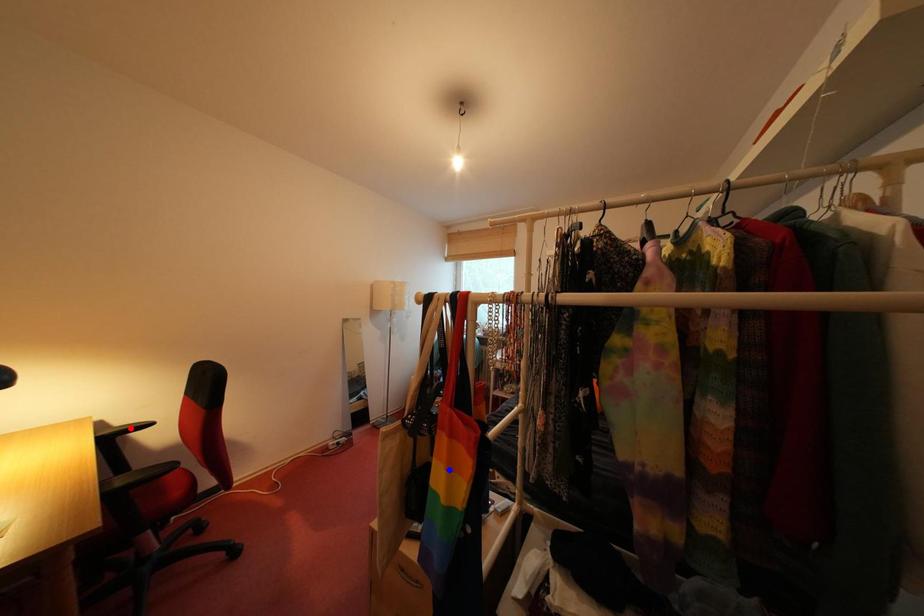
Question: Two points are marked on the image. Which point is closer to the camera?

Choices:
 (A) Blue point is closer.
 (B) Red point is closer.

Answer: (A)